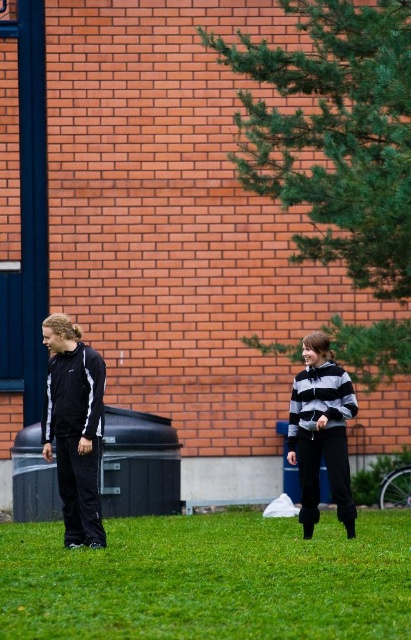
You are a photographer trying to capture a photo of the striped hoodie at center and the green grass at lower center. Based on their positions, which object is closer to the camera?

The striped hoodie at center is closer to the camera because the green grass at lower center is positioned under it, indicating it is behind.

You are standing at the point marked by the coordinates point (209, 580) in the image. What is the color of the ground beneath your feet?

The point (209, 580) marks green grass at lower center, so the ground beneath your feet is green grass.

You are a photographer trying to capture a closeup of the green grass at lower center. However, the matte black tracksuit at left is blocking your view. Can you estimate whether the grass area is smaller or larger than the tracksuit in the image?

The green grass at lower center occupies less space than the matte black tracksuit at left, so the grass area is smaller than the tracksuit in the image.